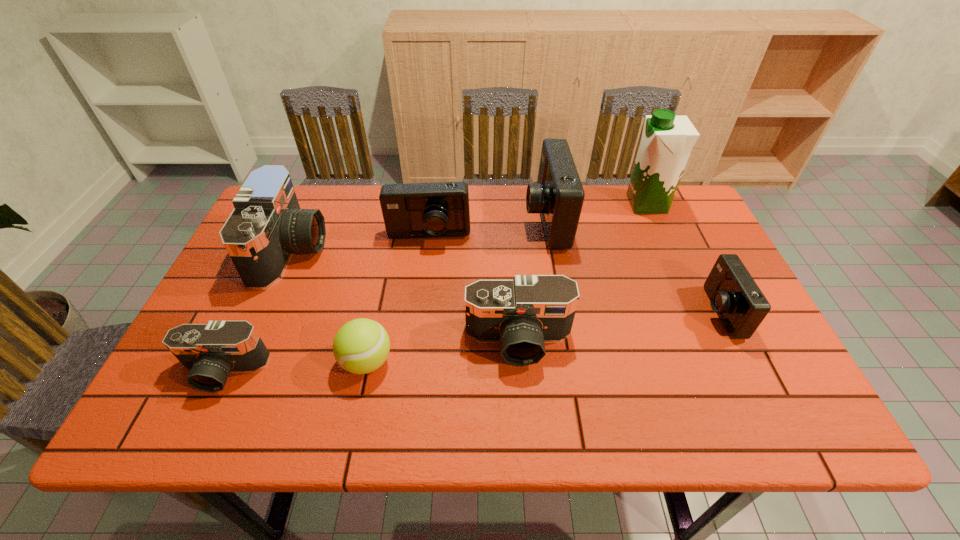
Identify the location of vacant space situated 0.240m on the front-facing side of the tallest object. (548, 204).

I want to click on free location located on the front-facing side of the tallest object, so click(533, 204).

Where is `vacant space located 0.130m on the front-facing side of the tallest object`? vacant space located 0.130m on the front-facing side of the tallest object is located at coordinates (584, 204).

The width and height of the screenshot is (960, 540). Identify the location of blank space located 0.370m on the front-facing side of the second blue camera from right to left. (400, 220).

Locate an element on the screen. This screenshot has width=960, height=540. vacant space located 0.200m on the front-facing side of the second blue camera from right to left is located at coordinates (457, 220).

Identify the location of free space located 0.080m on the front-facing side of the second blue camera from right to left. This screenshot has width=960, height=540. (497, 220).

This screenshot has width=960, height=540. I want to click on free space located on the front-facing side of the farthest black camera, so click(412, 251).

At what (x,y) coordinates should I click in order to perform the action: click on free space located on the front-facing side of the second biggest blue camera. Please return your answer as a coordinate pair (x, y). Looking at the image, I should click on (415, 352).

Identify the location of free point located on the front-facing side of the second smallest black camera. (524, 426).

This screenshot has height=540, width=960. Find the location of `vacant space located 0.220m on the front-facing side of the smallest blue camera`. vacant space located 0.220m on the front-facing side of the smallest blue camera is located at coordinates (612, 312).